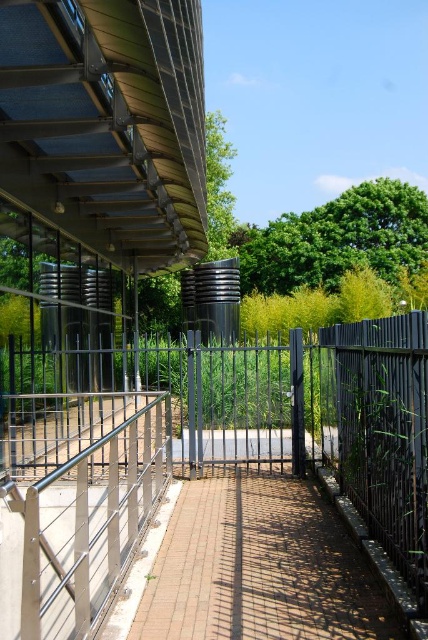
You are a delivery person trying to enter the area through the open gate. The black metal fence at center and the satin silver railing at lower left are both in your path. Which one do you need to go around because it is taller?

The black metal fence at center is much taller than the satin silver railing at lower left, so you need to go around the black metal fence at center.

You are standing at the entrance of the architectural structure and want to walk towards the green leafy tree at upper center. Which direction should you go relative to the brick paved path at center?

To reach the green leafy tree at upper center, you should walk towards the brick paved path at center since it is in front of the tree, meaning the path leads directly toward the tree.

You are standing at the entrance of the modern architectural structure and want to walk towards the two points marked in the image. Which point, point (51,518) or point (264,260), will you reach first?

You will reach point (51,518) first because it is closer to you than point (264,260).